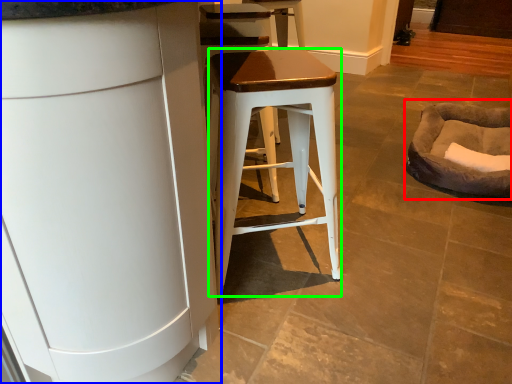
Question: Which object is the closest to the bean bag chair (highlighted by a red box)? Choose among these: cabinetry (highlighted by a blue box) or stool (highlighted by a green box).

Choices:
 (A) cabinetry
 (B) stool

Answer: (B)